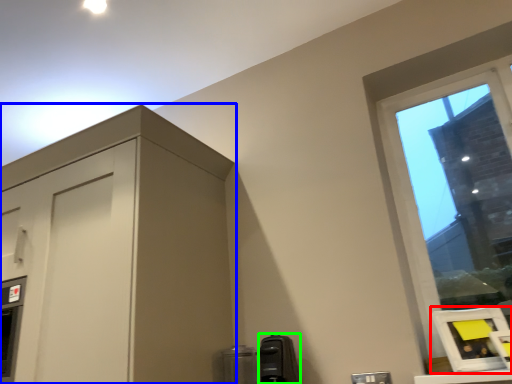
Question: Which object is the closest to the picture frame (highlighted by a red box)? Choose among these: dresser (highlighted by a blue box) or appliance (highlighted by a green box).

Choices:
 (A) dresser
 (B) appliance

Answer: (B)